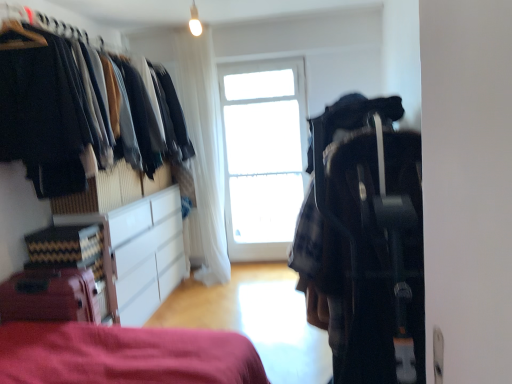
Where is `white glossy cabinet at lower left`? The width and height of the screenshot is (512, 384). white glossy cabinet at lower left is located at coordinates (146, 255).

This screenshot has width=512, height=384. What do you see at coordinates (364, 239) in the screenshot?
I see `plaid fabric backpack at center right` at bounding box center [364, 239].

I want to click on white sheer curtain at center, so click(204, 148).

You are a GUI agent. You are given a task and a screenshot of the screen. Output one action in this format:
    pyautogui.click(x=<x>, y=<y>)
    Task: Click on the matte black clothes at left
    Image resolution: width=512 pixels, height=384 pixels.
    Given the screenshot: What is the action you would take?
    pyautogui.click(x=75, y=111)

Is transparent glass window at center behind white glossy cabinet at lower left?

Yes, transparent glass window at center is behind white glossy cabinet at lower left.

Is transparent glass window at center not near white glossy cabinet at lower left?

transparent glass window at center is far away from white glossy cabinet at lower left.

Looking at their sizes, would you say transparent glass window at center is wider or thinner than white glossy cabinet at lower left?

Considering their sizes, transparent glass window at center looks slimmer than white glossy cabinet at lower left.

Does point (289, 205) appear closer or farther from the camera than point (179, 259)?

Point (289, 205) appears to be farther away from the viewer than point (179, 259).

Does plaid fabric backpack at center right turn towards white glossy cabinet at lower left?

No, plaid fabric backpack at center right is not turned towards white glossy cabinet at lower left.

Is plaid fabric backpack at center right not within white glossy cabinet at lower left?

Indeed, plaid fabric backpack at center right is completely outside white glossy cabinet at lower left.

From the image's perspective, which is below, plaid fabric backpack at center right or white glossy cabinet at lower left?

From the image's view, white glossy cabinet at lower left is below.

Between plaid fabric backpack at center right and white glossy cabinet at lower left, which one has more height?

Standing taller between the two is plaid fabric backpack at center right.

In the image, there is a matte black clothes at left. Find the location of `luggage below it (from a real-world perspective)`. luggage below it (from a real-world perspective) is located at coordinates (50, 296).

Can you confirm if matte red suitcase at lower left is wider than matte black clothes at left?

In fact, matte red suitcase at lower left might be narrower than matte black clothes at left.

Is matte red suitcase at lower left not within matte black clothes at left?

Yes, matte red suitcase at lower left is not within matte black clothes at left.

Is point (68, 316) farther from camera compared to point (50, 99)?

That is False.

Considering the relative positions of matte black clothes at left and transparent glass window at center in the image provided, is matte black clothes at left to the right of transparent glass window at center from the viewer's perspective?

In fact, matte black clothes at left is to the left of transparent glass window at center.

From a real-world perspective, which object stands above the other?

In real-world perspective, matte black clothes at left is above.

Identify the location of window that is behind the matte black clothes at left. (263, 156).

Does matte black clothes at left turn towards transparent glass window at center?

No, matte black clothes at left is not turned towards transparent glass window at center.

From a real-world perspective, is white sheer curtain at center above or below white glossy cabinet at lower left?

white sheer curtain at center is situated higher than white glossy cabinet at lower left in the real world.

From the image's perspective, is white sheer curtain at center over white glossy cabinet at lower left?

Yes, from the image's perspective, white sheer curtain at center is over white glossy cabinet at lower left.

Consider the image. Is white sheer curtain at center facing away from white glossy cabinet at lower left?

No, white sheer curtain at center's orientation is not away from white glossy cabinet at lower left.

Is point (178, 50) positioned before point (147, 254)?

That is False.

Considering the positions of objects plaid fabric backpack at center right and matte red suitcase at lower left in the image provided, who is behind, plaid fabric backpack at center right or matte red suitcase at lower left?

matte red suitcase at lower left.

Is plaid fabric backpack at center right inside or outside of matte red suitcase at lower left?

plaid fabric backpack at center right cannot be found inside matte red suitcase at lower left.

Which object is wider, plaid fabric backpack at center right or matte red suitcase at lower left?

Wider between the two is plaid fabric backpack at center right.

Which is more to the left, plaid fabric backpack at center right or matte red suitcase at lower left?

matte red suitcase at lower left is more to the left.

Is white sheer curtain at center at the back of matte red suitcase at lower left?

No, matte red suitcase at lower left is not facing away from white sheer curtain at center.

From the image's perspective, is matte red suitcase at lower left above or below white sheer curtain at center?

Clearly, from the image's perspective, matte red suitcase at lower left is below white sheer curtain at center.

Considering the points (51, 272) and (217, 114), which point is in front, point (51, 272) or point (217, 114)?

The point (51, 272) is more forward.

Considering the relative sizes of matte red suitcase at lower left and white sheer curtain at center in the image provided, is matte red suitcase at lower left smaller than white sheer curtain at center?

Indeed, matte red suitcase at lower left has a smaller size compared to white sheer curtain at center.

At what (x,y) coordinates should I click in order to perform the action: click on window behind the white glossy cabinet at lower left. Please return your answer as a coordinate pair (x, y). This screenshot has height=384, width=512. Looking at the image, I should click on (263, 156).

What are the coordinates of `cabinetry below the plaid fabric backpack at center right (from the image's perspective)` in the screenshot? It's located at (146, 255).

Considering their positions, is matte black clothes at left positioned closer to white glossy cabinet at lower left than matte red suitcase at lower left?

matte black clothes at left lies closer to white glossy cabinet at lower left than the other object.

From the image, which object appears to be nearer to plaid fabric backpack at center right, white glossy cabinet at lower left or transparent glass window at center?

Based on the image, white glossy cabinet at lower left appears to be nearer to plaid fabric backpack at center right.

From the image, which object appears to be farther from transparent glass window at center, plaid fabric backpack at center right or matte red suitcase at lower left?

The object further to transparent glass window at center is matte red suitcase at lower left.

Based on their spatial positions, is white sheer curtain at center or white glossy cabinet at lower left further from matte black clothes at left?

white sheer curtain at center lies further to matte black clothes at left than the other object.

Estimate the real-world distances between objects in this image. Which object is further from transparent glass window at center, white sheer curtain at center or matte red suitcase at lower left?

matte red suitcase at lower left.

Which object lies nearer to the anchor point matte red suitcase at lower left, white sheer curtain at center or white glossy cabinet at lower left?

Based on the image, white glossy cabinet at lower left appears to be nearer to matte red suitcase at lower left.

Which object lies further to the anchor point matte black clothes at left, plaid fabric backpack at center right or white sheer curtain at center?

Based on the image, plaid fabric backpack at center right appears to be further to matte black clothes at left.

Consider the image. When comparing their distances from white glossy cabinet at lower left, does plaid fabric backpack at center right or white sheer curtain at center seem further?

plaid fabric backpack at center right is positioned further to the anchor white glossy cabinet at lower left.

Locate an element on the screen. This screenshot has width=512, height=384. cabinetry between matte black clothes at left and matte red suitcase at lower left in the up-down direction is located at coordinates (146, 255).

You are a GUI agent. You are given a task and a screenshot of the screen. Output one action in this format:
    pyautogui.click(x=<x>, y=<y>)
    Task: Click on the curtain between matte red suitcase at lower left and transparent glass window at center along the z-axis
    The image size is (512, 384).
    Given the screenshot: What is the action you would take?
    pyautogui.click(x=204, y=148)

At what (x,y) coordinates should I click in order to perform the action: click on cabinetry between matte black clothes at left and plaid fabric backpack at center right in the horizontal direction. Please return your answer as a coordinate pair (x, y). This screenshot has width=512, height=384. Looking at the image, I should click on (146, 255).

Locate an element on the screen. Image resolution: width=512 pixels, height=384 pixels. closet between plaid fabric backpack at center right and white sheer curtain at center from front to back is located at coordinates point(75,111).